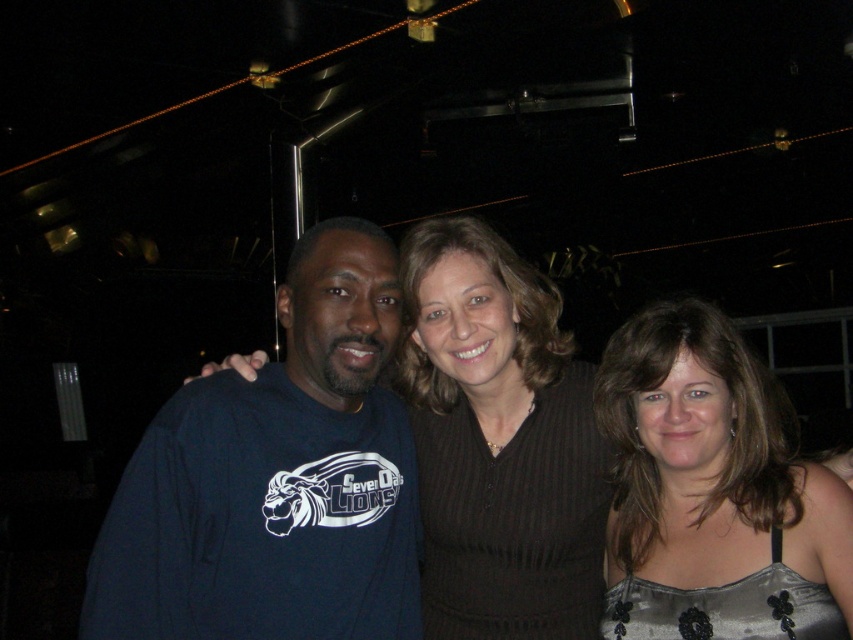
Between dark blue sweatshirt at left and silvery satin dress at center, which one is positioned higher?

dark blue sweatshirt at left is higher up.

Does dark blue sweatshirt at left have a greater width compared to silvery satin dress at center?

Correct, the width of dark blue sweatshirt at left exceeds that of silvery satin dress at center.

Between point (354, 275) and point (807, 532), which one is positioned behind?

Positioned behind is point (354, 275).

Locate an element on the screen. The height and width of the screenshot is (640, 853). dark blue sweatshirt at left is located at coordinates (276, 480).

Who is shorter, black knitwear at center or silvery satin dress at center?

Standing shorter between the two is silvery satin dress at center.

Can you confirm if black knitwear at center is taller than silvery satin dress at center?

Correct, black knitwear at center is much taller as silvery satin dress at center.

Is point (479, 269) positioned behind point (751, 634)?

Yes, point (479, 269) is behind point (751, 634).

Find the location of a particular element. This screenshot has height=640, width=853. black knitwear at center is located at coordinates (x=498, y=444).

Where is `dark blue sweatshirt at left`? The height and width of the screenshot is (640, 853). dark blue sweatshirt at left is located at coordinates tap(276, 480).

Consider the image. Measure the distance between dark blue sweatshirt at left and black knitwear at center.

They are 26.73 centimeters apart.

This screenshot has height=640, width=853. What do you see at coordinates (276, 480) in the screenshot?
I see `dark blue sweatshirt at left` at bounding box center [276, 480].

Find the location of a particular element. dark blue sweatshirt at left is located at coordinates 276,480.